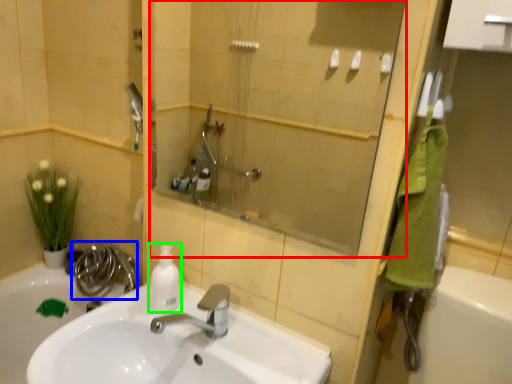
Question: Estimate the real-world distances between objects in this image. Which object is farther from mirror (highlighted by a red box), plumbing fixture (highlighted by a blue box) or cleaning product (highlighted by a green box)?

Choices:
 (A) plumbing fixture
 (B) cleaning product

Answer: (B)